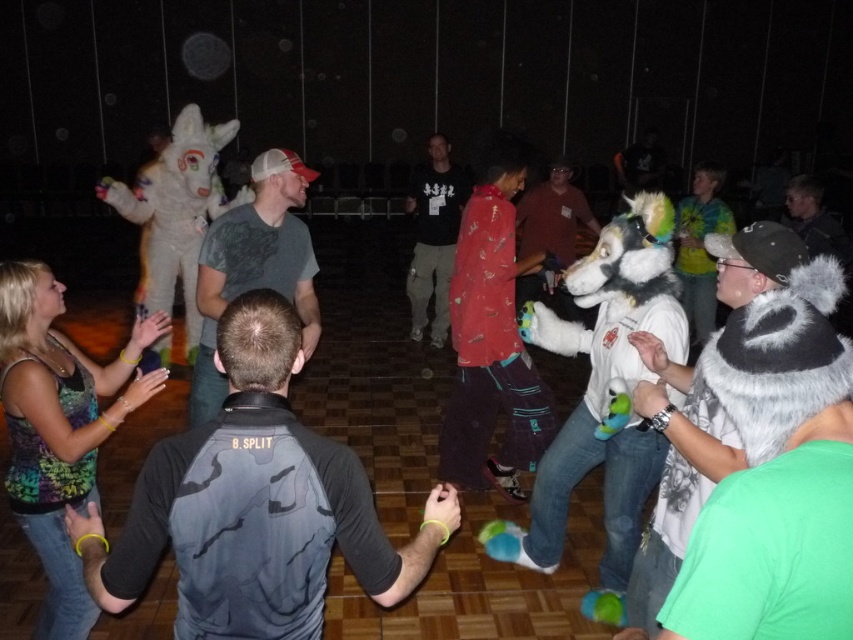
Question: Is dark gray/charcoal textured shirt at center positioned in front of red cotton hoodie at center?

Choices:
 (A) no
 (B) yes

Answer: (B)

Question: Which object appears closest to the camera in this image?

Choices:
 (A) white plush animal at left
 (B) white plush dog at center
 (C) fluffy red coat at center
 (D) green fuzzy costume at lower right

Answer: (D)

Question: Which object appears farthest from the camera in this image?

Choices:
 (A) fluffy gray fur at center
 (B) fluffy red coat at center

Answer: (B)

Question: In this image, where is green fuzzy costume at lower right located relative to multicolored fabric tank top at lower left?

Choices:
 (A) left
 (B) right

Answer: (B)

Question: Does white plush dog at center have a greater width compared to white plush animal at left?

Choices:
 (A) yes
 (B) no

Answer: (B)

Question: Which point appears closest to the camera in this image?

Choices:
 (A) (550, 202)
 (B) (219, 381)

Answer: (B)